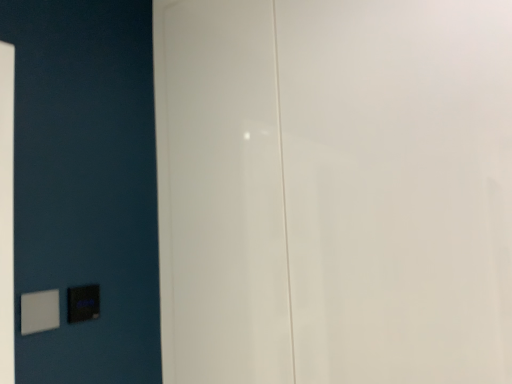
Question: Considering the relative positions of white glossy door at center and matte black switch at lower left, the first light switch in the back-to-front sequence, in the image provided, is white glossy door at center to the right of matte black switch at lower left, the first light switch in the back-to-front sequence, from the viewer's perspective?

Choices:
 (A) yes
 (B) no

Answer: (A)

Question: Can you confirm if white glossy door at center is smaller than matte black switch at lower left, the 1th light switch from the right?

Choices:
 (A) no
 (B) yes

Answer: (A)

Question: Can we say white glossy door at center lies outside matte black switch at lower left, which is counted as the 2th light switch, starting from the front?

Choices:
 (A) no
 (B) yes

Answer: (B)

Question: Is the depth of white glossy door at center less than that of matte black switch at lower left, which is counted as the 2th light switch, starting from the front?

Choices:
 (A) no
 (B) yes

Answer: (B)

Question: Is white glossy door at center oriented away from matte black switch at lower left, the first light switch in the back-to-front sequence?

Choices:
 (A) no
 (B) yes

Answer: (A)

Question: In terms of width, does matte black switch at lower left, the second light switch in the left-to-right sequence, look wider or thinner when compared to white plastic light switch at lower left, which ranks as the first light switch in front-to-back order?

Choices:
 (A) thin
 (B) wide

Answer: (A)

Question: From a real-world perspective, is matte black switch at lower left, which is counted as the 2th light switch, starting from the front, above or below white plastic light switch at lower left, which is the 2th light switch in right-to-left order?

Choices:
 (A) above
 (B) below

Answer: (A)

Question: Would you say matte black switch at lower left, which is counted as the 2th light switch, starting from the front, is to the left or to the right of white plastic light switch at lower left, which is the 2th light switch in right-to-left order, in the picture?

Choices:
 (A) right
 (B) left

Answer: (A)

Question: Is point (74, 297) positioned closer to the camera than point (45, 296)?

Choices:
 (A) closer
 (B) farther

Answer: (B)

Question: Is white plastic light switch at lower left, the first light switch positioned from the left, spatially inside matte black switch at lower left, the 1th light switch from the right, or outside of it?

Choices:
 (A) inside
 (B) outside

Answer: (B)

Question: Is white plastic light switch at lower left, which ranks as the first light switch in front-to-back order, in front of or behind matte black switch at lower left, the second light switch in the left-to-right sequence, in the image?

Choices:
 (A) behind
 (B) front

Answer: (B)

Question: Considering the positions of white plastic light switch at lower left, the first light switch positioned from the left, and matte black switch at lower left, which is counted as the 2th light switch, starting from the front, in the image, is white plastic light switch at lower left, the first light switch positioned from the left, taller or shorter than matte black switch at lower left, which is counted as the 2th light switch, starting from the front,?

Choices:
 (A) short
 (B) tall

Answer: (B)

Question: Is white plastic light switch at lower left, the second light switch when ordered from back to front, bigger or smaller than matte black switch at lower left, the second light switch in the left-to-right sequence?

Choices:
 (A) small
 (B) big

Answer: (B)

Question: Considering the positions of white glossy door at center and white plastic light switch at lower left, the first light switch positioned from the left, in the image, is white glossy door at center taller or shorter than white plastic light switch at lower left, the first light switch positioned from the left,?

Choices:
 (A) short
 (B) tall

Answer: (B)

Question: In terms of size, does white glossy door at center appear bigger or smaller than white plastic light switch at lower left, which ranks as the first light switch in front-to-back order?

Choices:
 (A) big
 (B) small

Answer: (A)